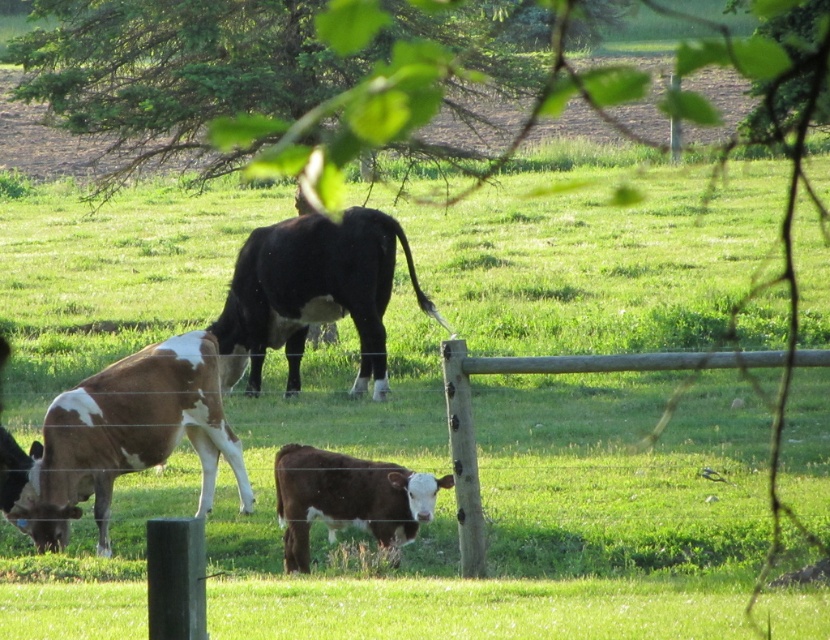
Is brown and white speckled cow at left smaller than black glossy cow at center?

Yes, brown and white speckled cow at left is smaller than black glossy cow at center.

Is point (201, 372) positioned after point (389, 248)?

No, it is in front of (389, 248).

Locate an element on the screen. The image size is (830, 640). brown and white speckled cow at left is located at coordinates (120, 438).

Does green leafy tree at upper center have a lesser height compared to brown smooth calf at center?

No, green leafy tree at upper center is not shorter than brown smooth calf at center.

Does point (482, 182) lie behind point (384, 508)?

Yes, point (482, 182) is behind point (384, 508).

At what (x,y) coordinates should I click in order to perform the action: click on green leafy tree at upper center. Please return your answer as a coordinate pair (x, y). This screenshot has height=640, width=830. Looking at the image, I should click on (378, 115).

Locate an element on the screen. This screenshot has width=830, height=640. green leafy tree at upper center is located at coordinates (378, 115).

From the picture: Can you confirm if brown and white speckled cow at left is positioned above brown smooth calf at center?

Yes.

Where is `brown and white speckled cow at left`? The width and height of the screenshot is (830, 640). brown and white speckled cow at left is located at coordinates (120, 438).

Locate an element on the screen. brown and white speckled cow at left is located at coordinates (120, 438).